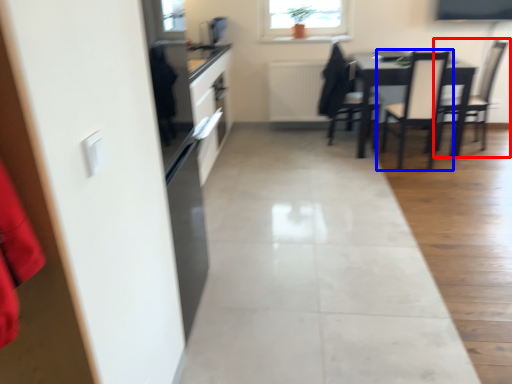
Question: Which object is closer to the camera taking this photo, chair (highlighted by a red box) or chair (highlighted by a blue box)?

Choices:
 (A) chair
 (B) chair

Answer: (B)